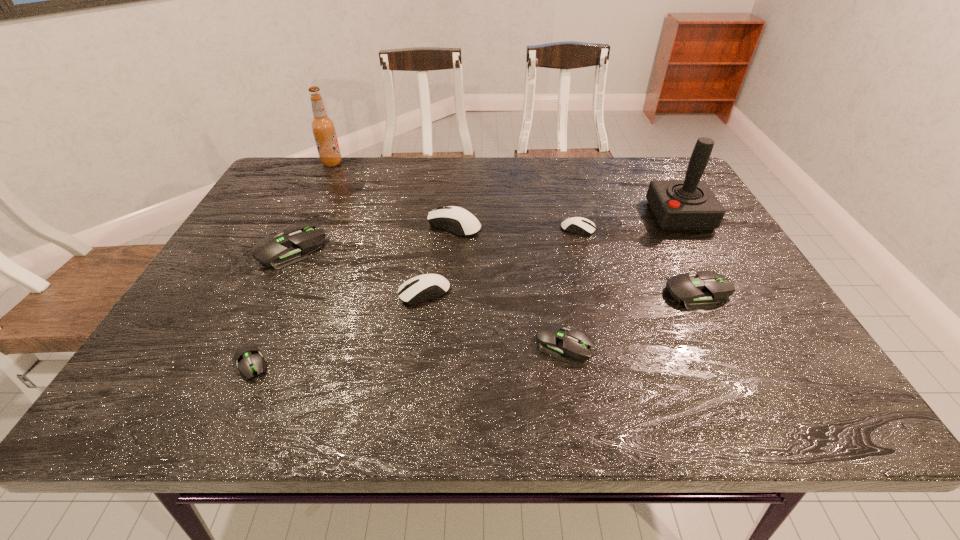
The image size is (960, 540). I want to click on vacant space that satisfies the following two spatial constraints: 1. on the base of the red joystick; 2. on the front side of the shortest computer mouse, so click(x=764, y=364).

I want to click on vacant space that satisfies the following two spatial constraints: 1. on the front side of the shortest object; 2. on the left side of the farthest gray computer mouse, so click(x=236, y=364).